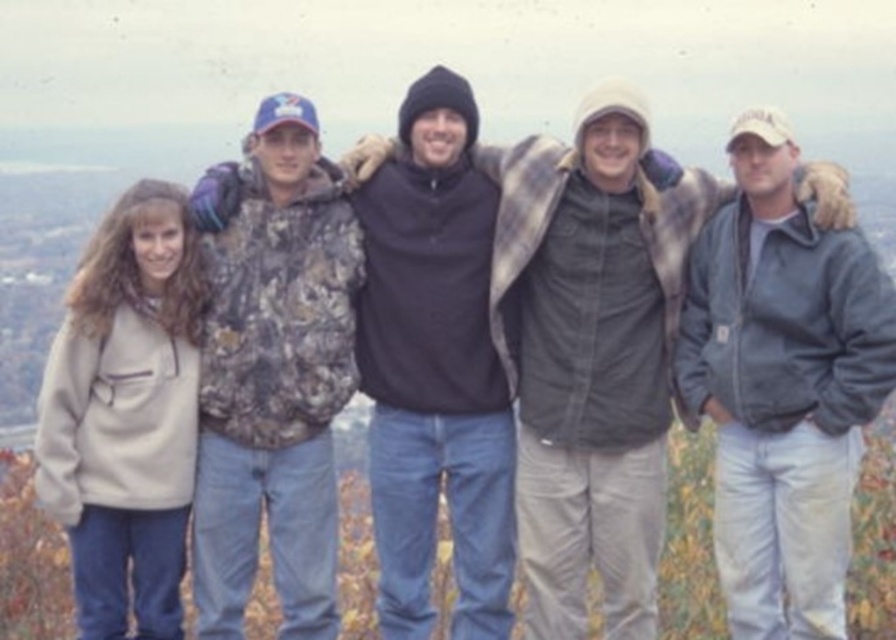
You are a photographer trying to capture a group photo of the five people in the scene. You notice two fleece jackets at the center of the image. Which fleece jacket is positioned lower in the image, the gray fleece jacket at center or the black fleece jacket at center?

The gray fleece jacket at center is located below the black fleece jacket at center, so the gray fleece jacket at center is positioned lower in the image.